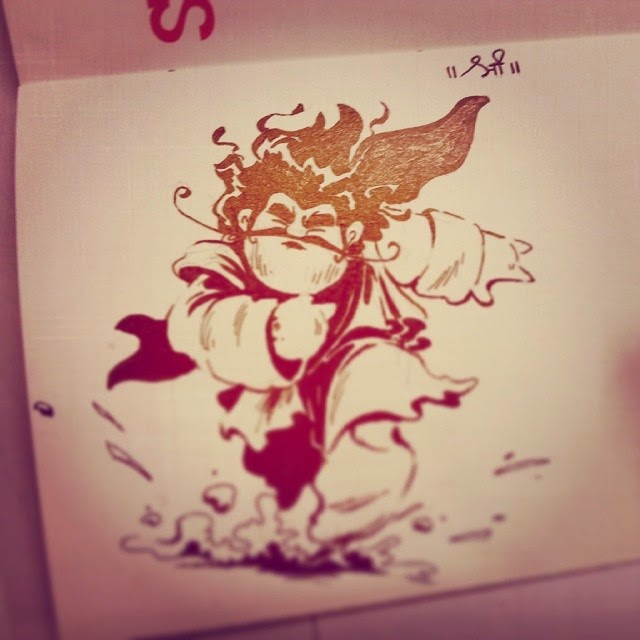
The width and height of the screenshot is (640, 640). Find the location of `red cloth`. red cloth is located at coordinates (340, 299).